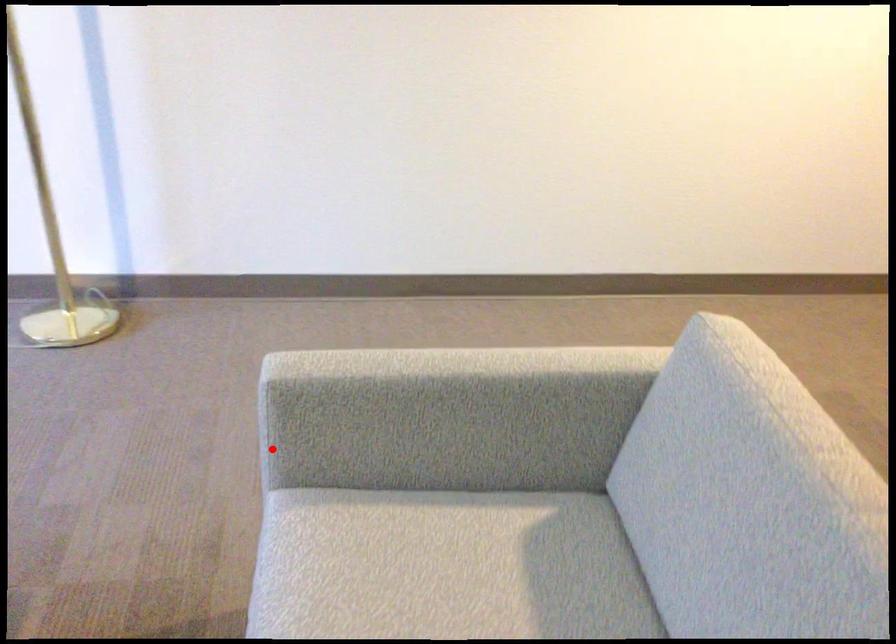
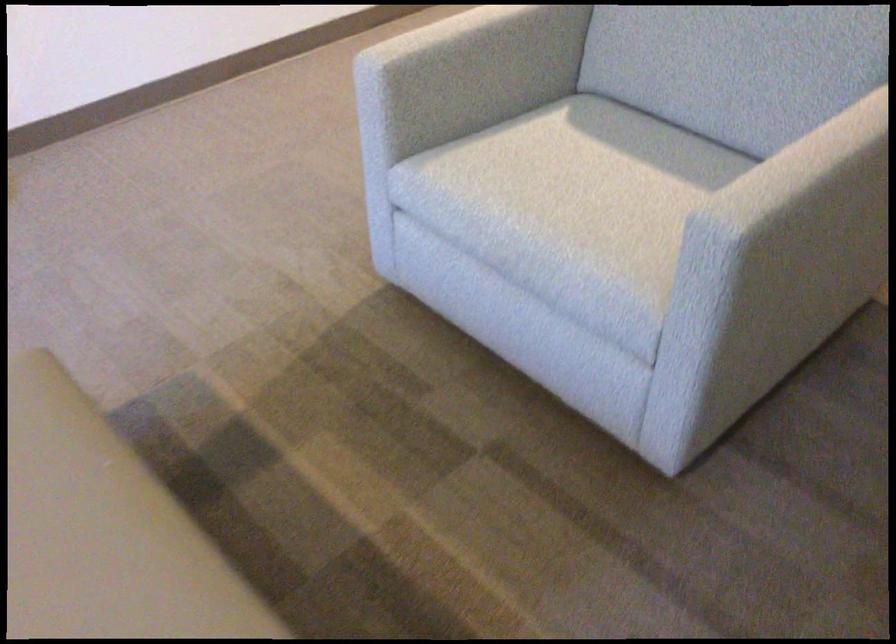
Locate, in the second image, the point that corresponds to the highlighted location in the first image.

(385, 120)